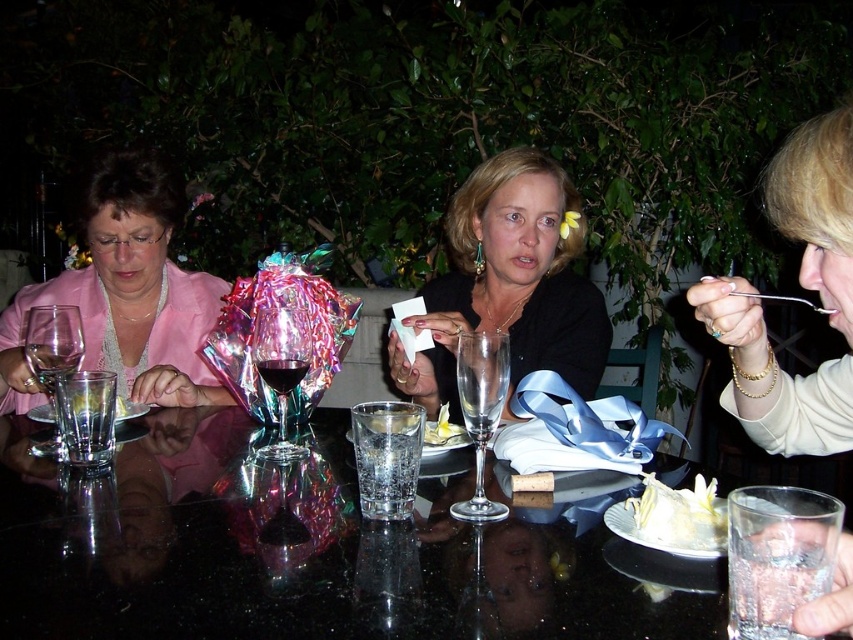
Describe the element at coordinates (801, 285) in the screenshot. I see `gold bracelet at upper right` at that location.

Which is behind, point (844, 586) or point (271, 364)?

Point (271, 364)

This screenshot has width=853, height=640. What are the coordinates of `gold bracelet at upper right` in the screenshot? It's located at (801, 285).

Between transparent glass at center and yellow paper at center, which one has more height?

transparent glass at center is taller.

In the scene shown: Does transparent glass at center have a lesser width compared to yellow paper at center?

In fact, transparent glass at center might be wider than yellow paper at center.

The height and width of the screenshot is (640, 853). Identify the location of transparent glass at center. (86, 416).

Based on the photo, which of these two, gold bracelet at upper right or clear glass water at center, stands shorter?

clear glass water at center

Is point (807, 148) positioned before point (386, 422)?

Yes.

This screenshot has height=640, width=853. Find the location of `gold bracelet at upper right`. gold bracelet at upper right is located at coordinates (801, 285).